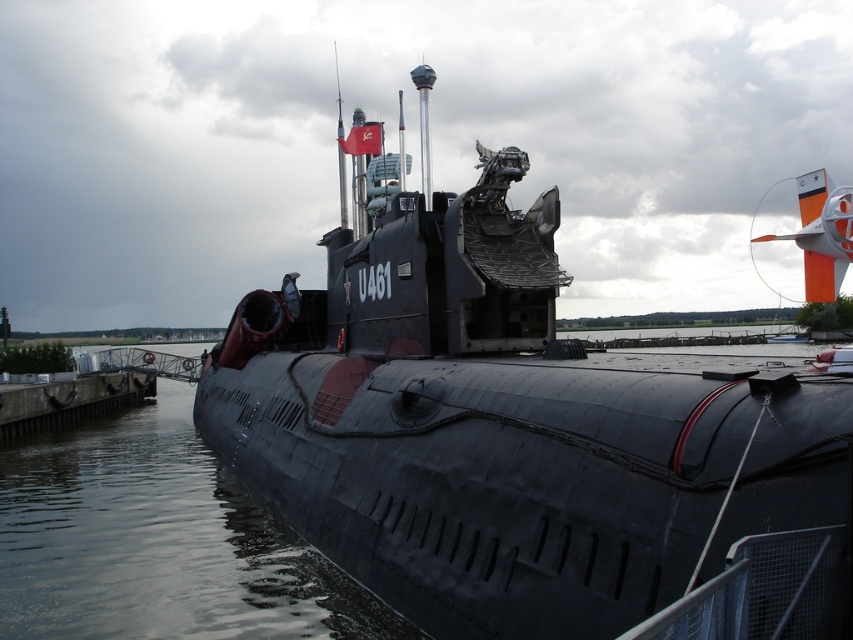
Question: Is matte black submarine at center in front of black rubber waterway at lower left?

Choices:
 (A) no
 (B) yes

Answer: (B)

Question: Is matte black submarine at center positioned in front of smooth concrete dock at lower left?

Choices:
 (A) no
 (B) yes

Answer: (B)

Question: Does black rubber waterway at lower left have a smaller size compared to smooth concrete dock at lower left?

Choices:
 (A) no
 (B) yes

Answer: (A)

Question: Which of the following is the closest to the observer?

Choices:
 (A) matte black submarine at center
 (B) black rubber waterway at lower left
 (C) smooth concrete dock at lower left

Answer: (A)

Question: Which point is closer to the camera taking this photo?

Choices:
 (A) (468, 337)
 (B) (86, 380)

Answer: (A)

Question: Among these points, which one is farthest from the camera?

Choices:
 (A) (285, 486)
 (B) (194, 468)

Answer: (B)